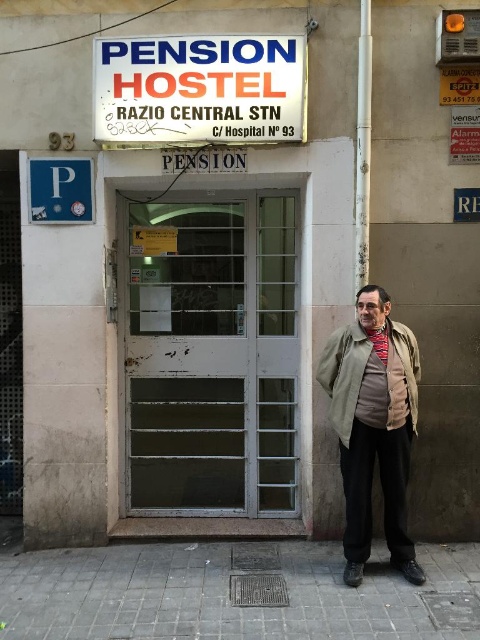
You are a traveler standing at the entrance of the PENSION HOSTEL. You notice two items hanging on a coat rack at the center of the entrance. The items are the khaki fabric jacket at center and the striped wool scarf at center. Which item is positioned lower on the coat rack?

The khaki fabric jacket at center is located below the striped wool scarf at center, so the jacket is positioned lower on the coat rack.

You are a traveler carrying an olive green fabric trench coat at center and a striped wool scarf at center. You want to enter the Pension Hostel through the double glass doors. Since the doors have a rectangular section without glass at the bottom, which item might you need to hold higher to avoid it?

The olive green fabric trench coat at center is wider than the striped wool scarf at center, so you would need to hold the olive green fabric trench coat at center higher to avoid the rectangular section without glass at the bottom of the doors.

You are a delivery person approaching the Pension Hostel entrance. You need to deliver a package to the white plastic sign at upper center. Where exactly should you look to find it?

The white plastic sign at upper center is located at point (200,90).